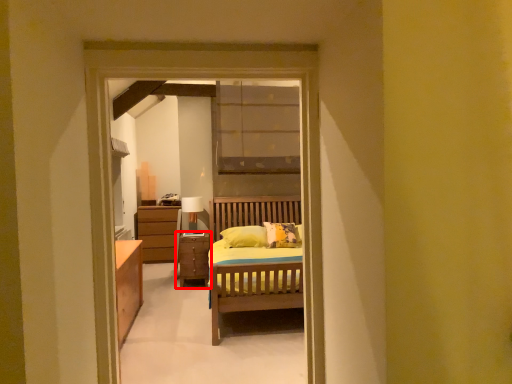
Question: From the image's perspective, where is chest of drawers (annotated by the red box) located in relation to table lamp in the image?

Choices:
 (A) above
 (B) below

Answer: (B)